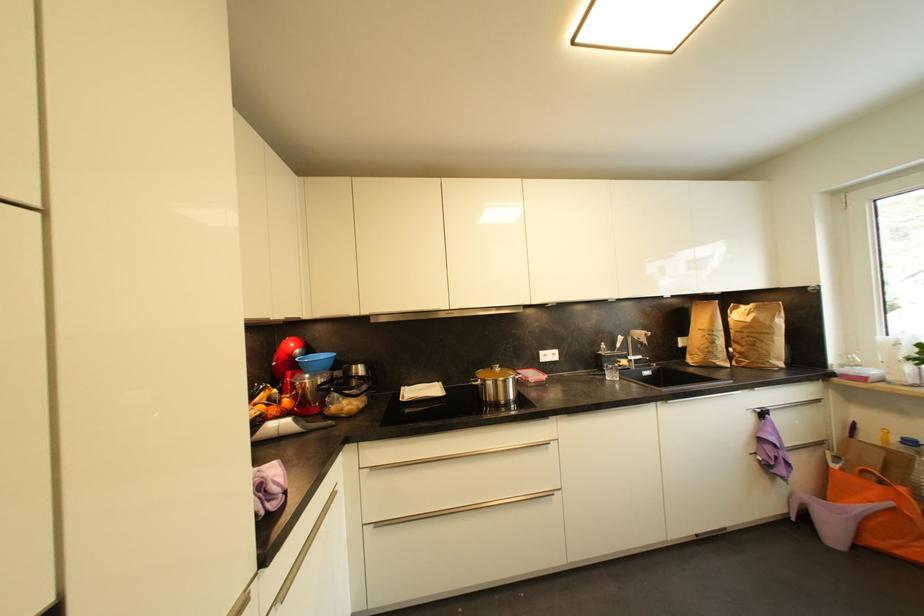
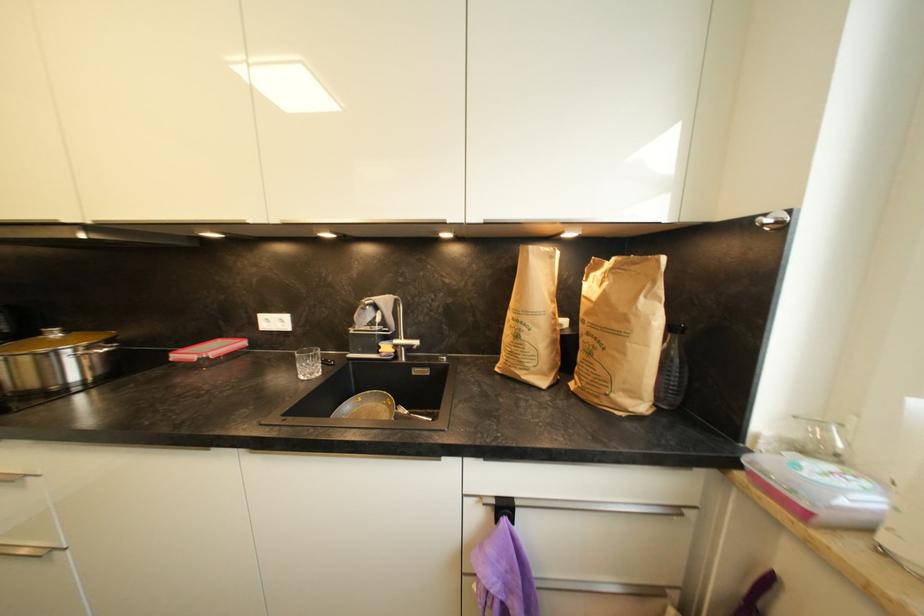
Which direction would the cameraman need to move to produce the second image?

The cameraman moved toward right, forward.